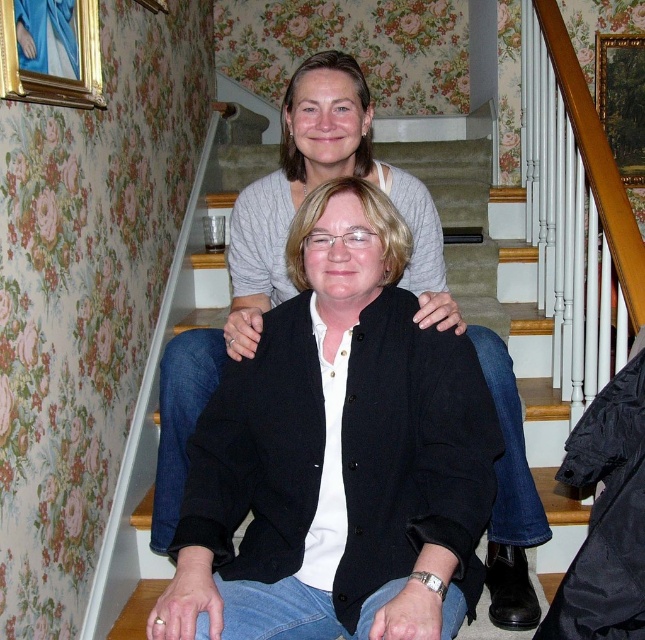
Is point (92, 4) less distant than point (622, 173)?

Yes, it is.

Which is below, gold-framed painting at upper left or wooden picture frame at upper right?

gold-framed painting at upper left is lower down.

In order to click on gold-framed painting at upper left in this screenshot , I will do `click(50, 51)`.

Is wooden staircase at center positioned before wooden picture frame at upper right?

Yes, it is.

Is wooden staircase at center positioned behind wooden picture frame at upper right?

No.

Image resolution: width=645 pixels, height=640 pixels. What are the coordinates of `wooden staircase at center` in the screenshot? It's located at (157, 397).

Can you confirm if wooden staircase at center is smaller than gold-framed painting at upper left?

Actually, wooden staircase at center might be larger than gold-framed painting at upper left.

Which is in front, point (148, 513) or point (74, 16)?

Point (74, 16)

Where is `wooden staircase at center`? This screenshot has height=640, width=645. wooden staircase at center is located at coordinates (157, 397).

What are the coordinates of `wooden staircase at center` in the screenshot? It's located at (157, 397).